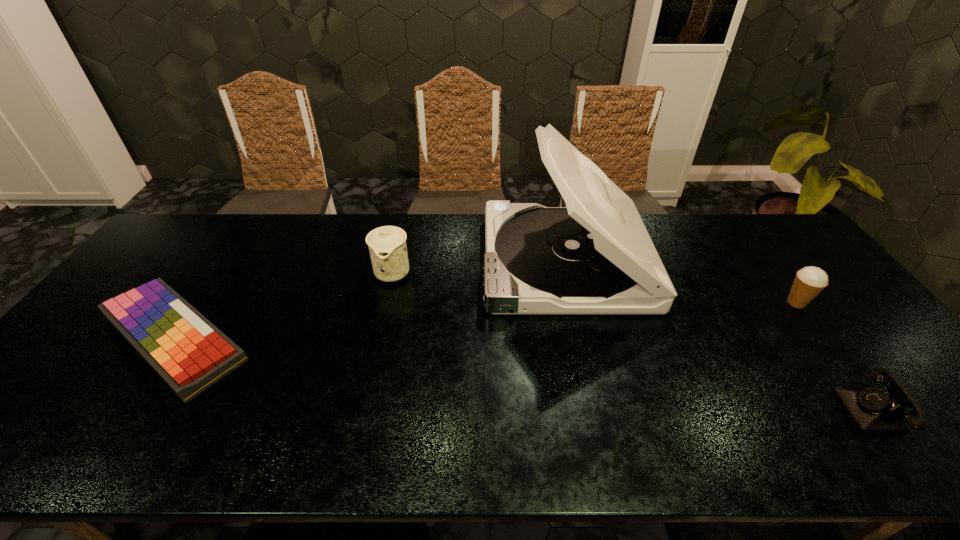
Locate an element on the screen. the third object from left to right is located at coordinates (595, 256).

Where is `the tallest object`? the tallest object is located at coordinates (595, 256).

I want to click on the second tallest object, so click(x=387, y=245).

In order to click on the second object from left to right in this screenshot , I will do `click(387, 245)`.

At what (x,y) coordinates should I click in order to perform the action: click on the third shortest object. Please return your answer as a coordinate pair (x, y). The image size is (960, 540). Looking at the image, I should click on (809, 281).

Find the location of a particular element. the fourth tallest object is located at coordinates pos(872,410).

I want to click on the leftmost object, so click(x=190, y=353).

Identify the location of the shortest object. The width and height of the screenshot is (960, 540). (190, 353).

In order to click on vacant area situated on the control panel of the third object from left to right in this screenshot , I will do `click(436, 261)`.

Where is `blank space located 0.240m on the control panel of the third object from left to right`? blank space located 0.240m on the control panel of the third object from left to right is located at coordinates (407, 261).